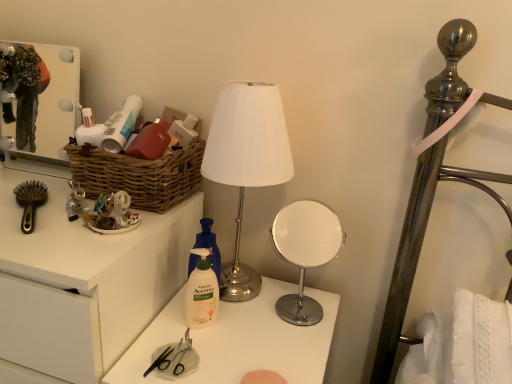
Locate an element on the screen. vacant space behind metallic silver scissors at center is located at coordinates tap(201, 323).